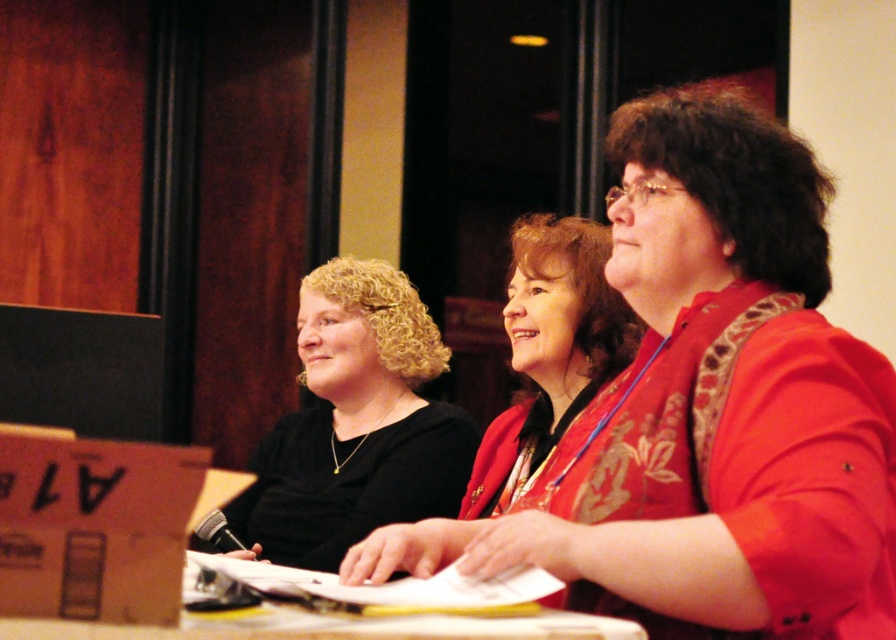
Question: Does matte red jacket at center have a larger size compared to white glossy table at lower center?

Choices:
 (A) yes
 (B) no

Answer: (A)

Question: Does matte red jacket at center have a larger size compared to white glossy table at lower center?

Choices:
 (A) yes
 (B) no

Answer: (A)

Question: Among these objects, which one is nearest to the camera?

Choices:
 (A) white glossy table at lower center
 (B) black matte shirt at center
 (C) matte red blouse at center

Answer: (A)

Question: Which point appears closest to the camera in this image?

Choices:
 (A) (530, 340)
 (B) (375, 317)
 (C) (580, 461)

Answer: (C)

Question: Which of the following is the farthest from the observer?

Choices:
 (A) (586, 344)
 (B) (250, 563)
 (C) (731, 595)
 (D) (453, 456)

Answer: (D)

Question: Is matte red blouse at center to the left of white glossy table at lower center from the viewer's perspective?

Choices:
 (A) no
 (B) yes

Answer: (A)